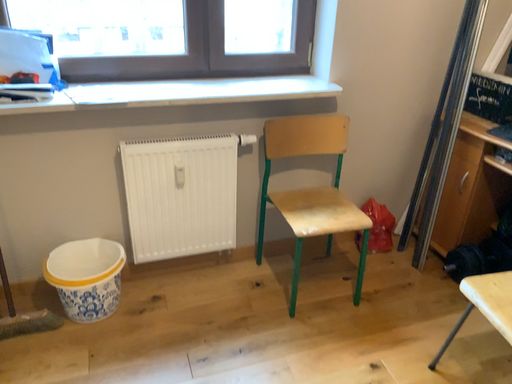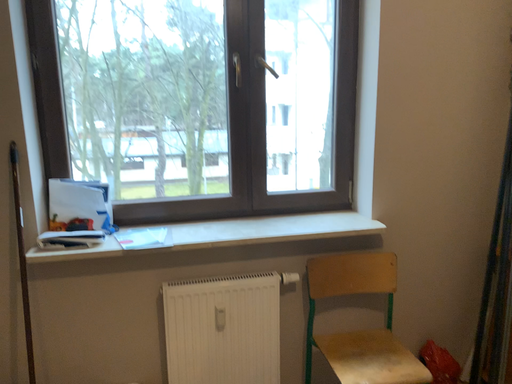
Question: How did the camera likely rotate when shooting the video?

Choices:
 (A) rotated left
 (B) rotated right

Answer: (A)